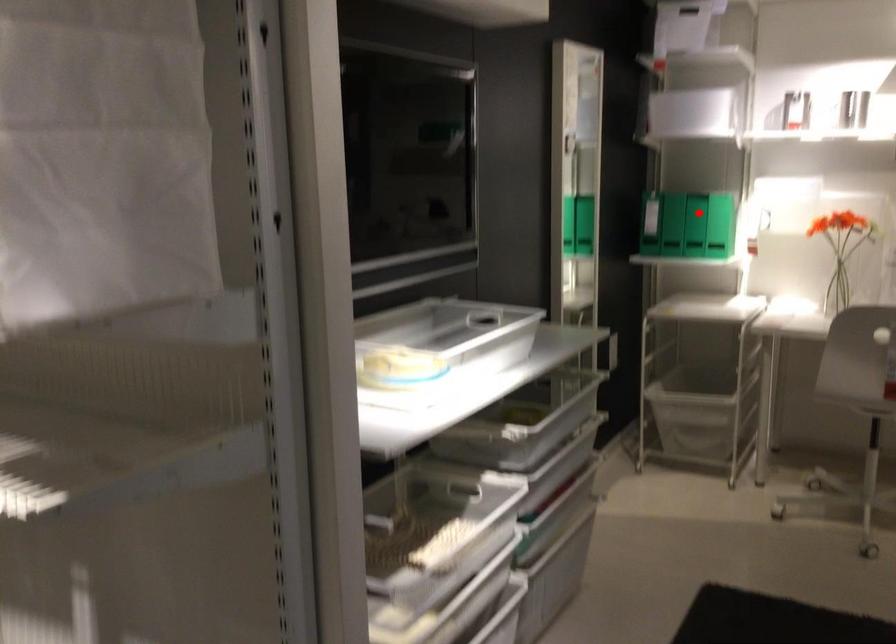
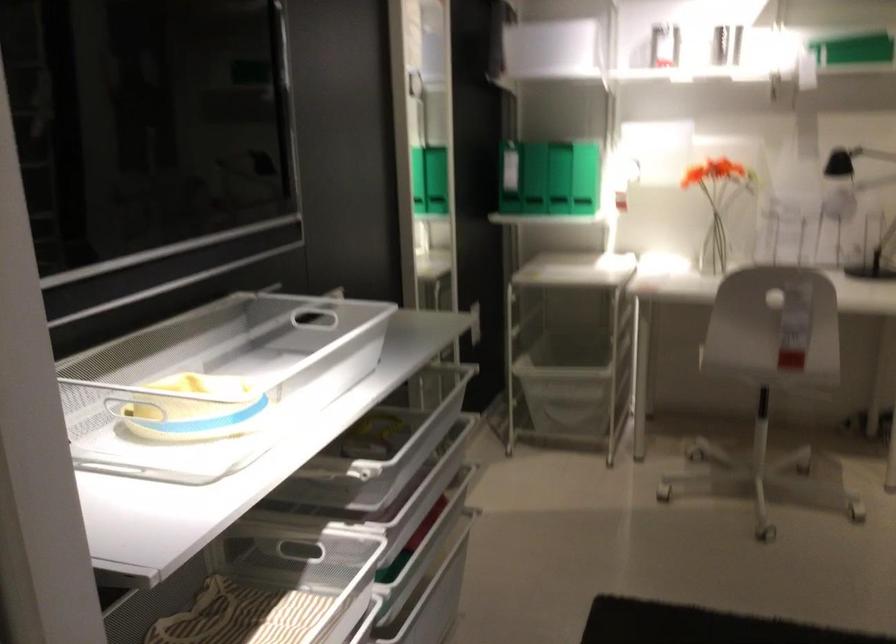
The point at the highlighted location is marked in the first image. Where is the corresponding point in the second image?

(533, 178)